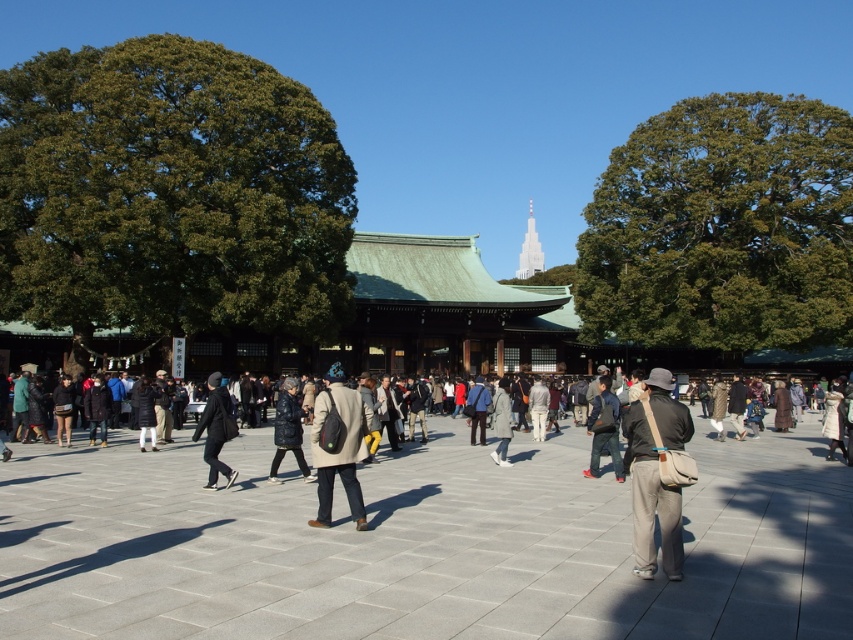
You are a photographer standing at the edge of the paved area in the shrine complex. You want to take a photo of the traditional building in the background without any people blocking it. However, there are two items in your viewfinder at the center of the scene. What should you do to ensure the khaki canvas bag at center and the dark gray fabric jacket at center are not blocking the building?

Since the khaki canvas bag at center is in front of the dark gray fabric jacket at center, you should wait until the khaki canvas bag at center moves out of the frame first. Once it is gone, the dark gray fabric jacket at center will be the closest object, and you can then wait for it to move so the building remains unobstructed.

You are a visitor at the shrine and want to retrieve your dark gray fabric jacket at center from under your matte black backpack at center. Is the jacket accessible without moving the backpack?

The matte black backpack at center is positioned over the dark gray fabric jacket at center, so you will need to move the backpack to access the jacket.

In the scene shown: You are a visitor at the shrine and want to place your khaki canvas bag at center and dark gray fabric jacket at center on a bench. The bench can only hold items that are smaller than 30 cm in length. Which item can you place on the bench?

The khaki canvas bag at center has a smaller size compared to dark gray fabric jacket at center, so the khaki canvas bag at center can be placed on the bench as it is smaller than 30 cm in length.